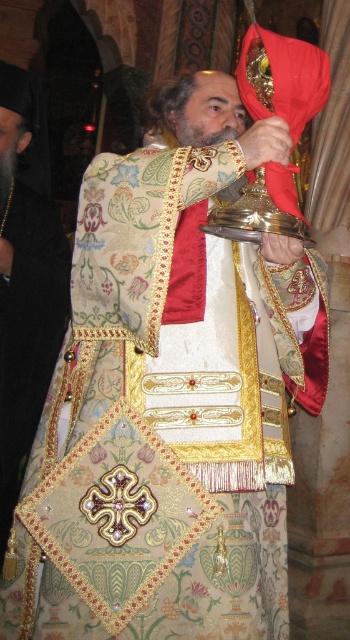
You are standing in the church and looking at the clergy member. Which of the two points, point (29, 296) or point (208, 140), is closer to you?

Point (29, 296) is closer to you because it is further to the camera than point (208, 140).